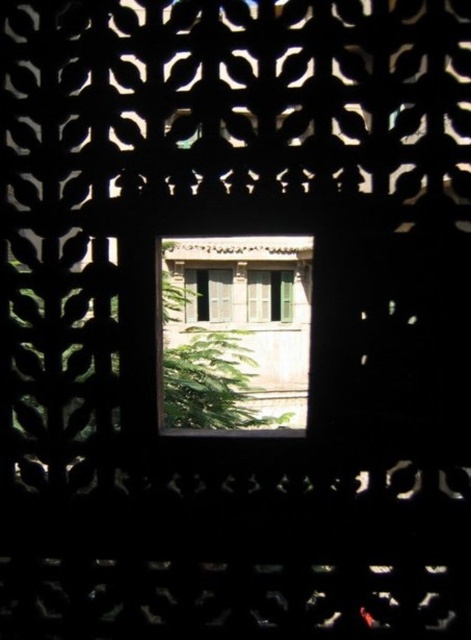
Question: Is wooden window at center bigger than green matte door at center?

Choices:
 (A) no
 (B) yes

Answer: (B)

Question: Which object is farther from the camera taking this photo?

Choices:
 (A) wooden window at center
 (B) green matte window at center

Answer: (B)

Question: Observing the image, what is the correct spatial positioning of wooden window at center in reference to green matte door at center?

Choices:
 (A) left
 (B) right

Answer: (A)

Question: Which point is farther to the camera?

Choices:
 (A) green matte window at center
 (B) wooden window at center

Answer: (A)

Question: Can you confirm if wooden window at center is wider than green matte door at center?

Choices:
 (A) yes
 (B) no

Answer: (A)

Question: Which of the following is the closest to the observer?

Choices:
 (A) green matte window at center
 (B) green matte door at center
 (C) wooden window at center

Answer: (C)